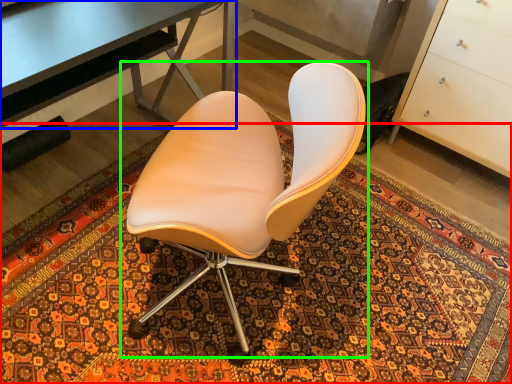
Question: Based on their relative distances, which object is nearer to mat (highlighted by a red box)? Choose from desk (highlighted by a blue box) and chair (highlighted by a green box).

Choices:
 (A) desk
 (B) chair

Answer: (B)